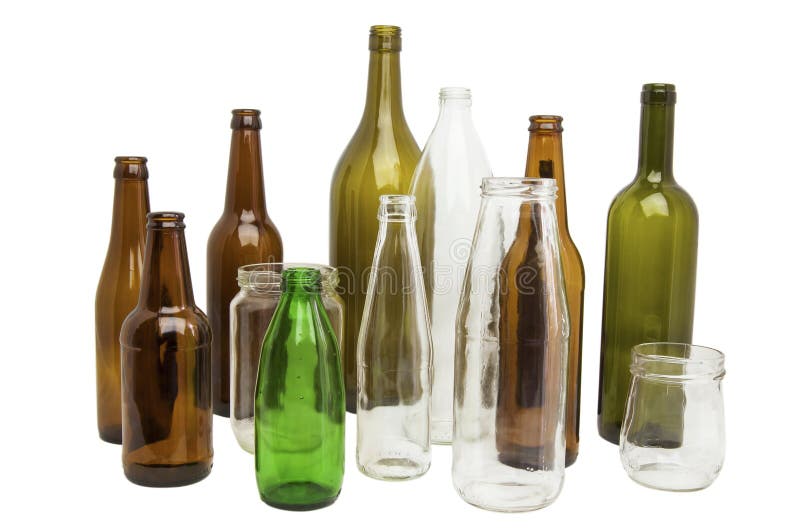
The width and height of the screenshot is (800, 532). I want to click on glass bottles, so click(121, 265), click(153, 337), click(224, 244), click(358, 186), click(294, 365), click(396, 339), click(453, 217), click(538, 165), click(646, 186), click(524, 350).